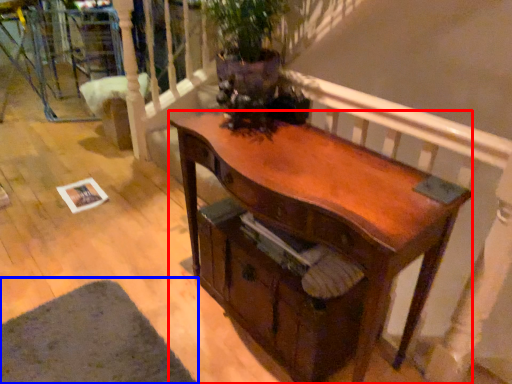
Question: Which object is further to the camera taking this photo, desk (highlighted by a red box) or mat (highlighted by a blue box)?

Choices:
 (A) desk
 (B) mat

Answer: (B)